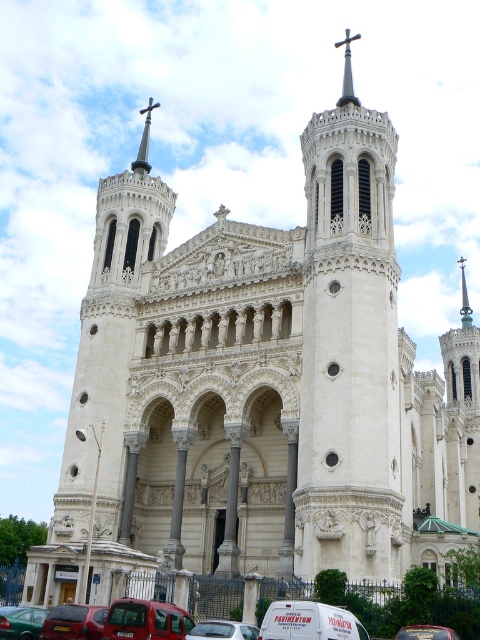
Does point (242, 636) come behind point (346, 99)?

No, it is not.

Looking at this image, can you confirm if white glossy car at center is wider than polished silver cross at upper center?

No.

Does point (205, 627) lie in front of point (348, 33)?

Yes, it is in front of point (348, 33).

The height and width of the screenshot is (640, 480). In order to click on white glossy car at center in this screenshot , I will do `click(223, 630)`.

Measure the distance between point (257, 636) and camera.

They are 38.91 meters apart.

Does white glossy car at center have a smaller size compared to metallic silver van at center?

Correct, white glossy car at center occupies less space than metallic silver van at center.

You are a GUI agent. You are given a task and a screenshot of the screen. Output one action in this format:
    pyautogui.click(x=<x>, y=<y>)
    Task: Click on the white glossy car at center
    This screenshot has width=480, height=640.
    Given the screenshot: What is the action you would take?
    click(x=223, y=630)

Is metallic red van at lower left to the right of green matte car at lower left from the viewer's perspective?

Indeed, metallic red van at lower left is positioned on the right side of green matte car at lower left.

Is point (164, 621) more distant than point (7, 621)?

That is False.

Where is `metallic red van at lower left`? The image size is (480, 640). metallic red van at lower left is located at coordinates (145, 620).